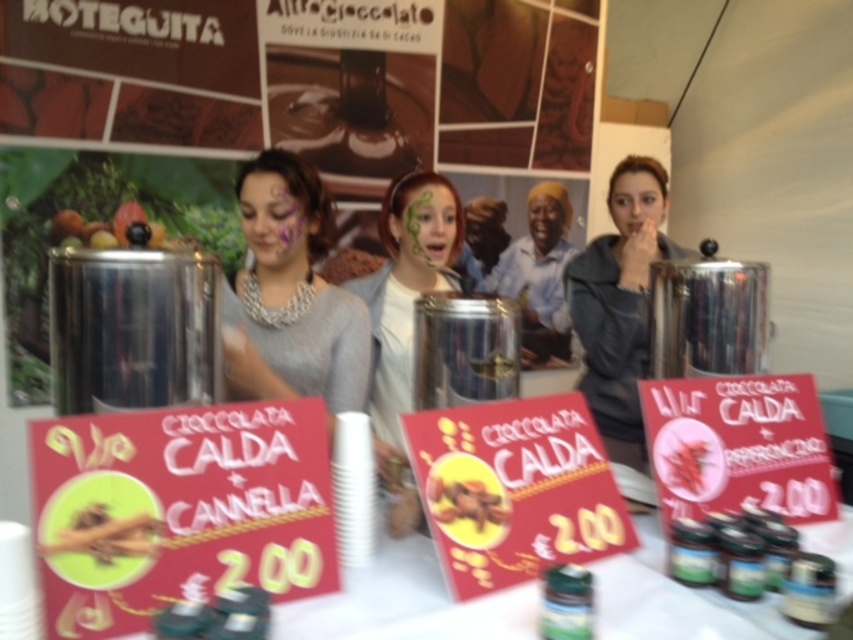
Question: From the image, what is the correct spatial relationship of green matte face paint at center in relation to brown matte nuts at center?

Choices:
 (A) left
 (B) right

Answer: (A)

Question: Does green matte face paint at center have a greater width compared to yellow cinnamon sticks at center?

Choices:
 (A) no
 (B) yes

Answer: (B)

Question: Based on their relative distances, which object is nearer to the matte gray sweater at center?

Choices:
 (A) smooth skin face at center
 (B) smooth skin face at upper center
 (C) yellow cinnamon sticks at center
 (D) matte purple face paint at center

Answer: (D)

Question: Which object is the closest to the matte purple face paint at center?

Choices:
 (A) smooth skin face at center
 (B) yellow cinnamon sticks at center
 (C) smooth skin face at upper center

Answer: (B)

Question: From the image, what is the correct spatial relationship of matte purple face paint at center in relation to yellow cinnamon sticks at center?

Choices:
 (A) left
 (B) right

Answer: (B)

Question: Which object is closer to the camera taking this photo?

Choices:
 (A) yellow cinnamon sticks at center
 (B) matte gray sweater at center
 (C) green matte face paint at center
 (D) matte purple face paint at center

Answer: (A)